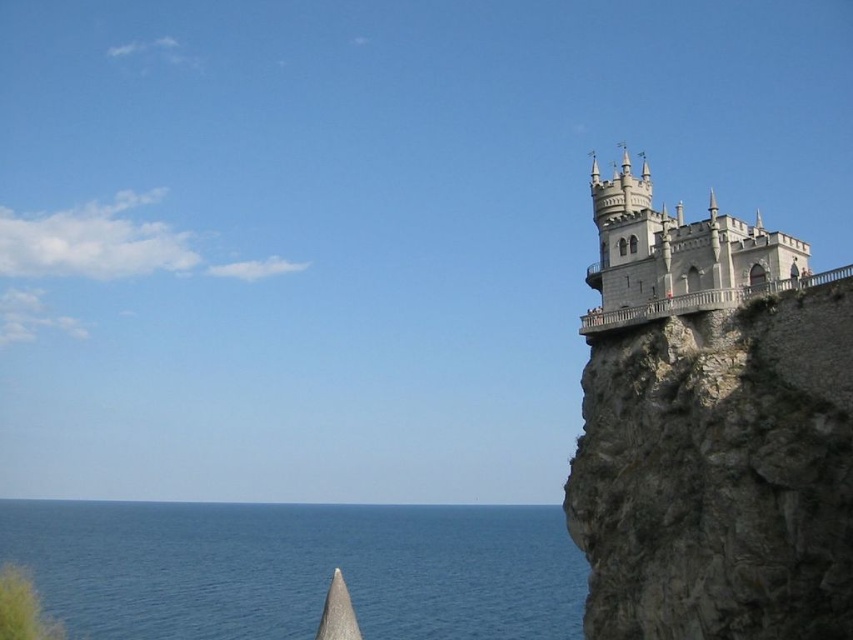
You are a construction worker tasked with building a bridge between the gray rocky cliff at right and the white stone castle at upper right. The bridge you have is 8 meters long. Will the bridge be long enough to connect them?

The gray rocky cliff at right and white stone castle at upper right are 8.32 meters apart from each other. The bridge is only 8 meters long, so it will not be long enough to span the distance between them.

You are standing on the cliff near the white stone castle at upper right and looking towards the blue water at lower left. Which object appears taller from your perspective?

The white stone castle at upper right appears taller than the blue water at lower left because the blue water at lower left has a lesser height compared to the white stone castle at upper right.

You are standing in front of the castle and want to determine the relative positions of two points marked on the structure. The first point is located at coordinates point [357,536] and the second at point [605,180]. Which point is closer to you?

Point [357,536] is closer to you because it is further to the viewer than point [605,180].